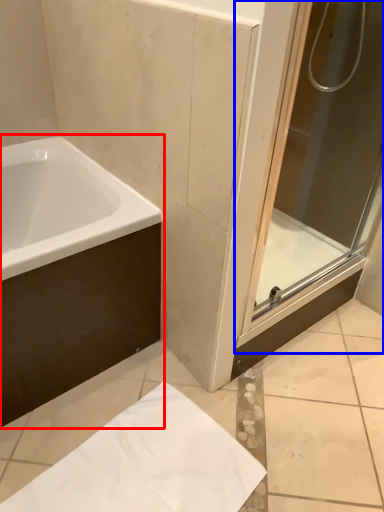
Question: Which object is closer to the camera taking this photo, bathtub (highlighted by a red box) or screen door (highlighted by a blue box)?

Choices:
 (A) bathtub
 (B) screen door

Answer: (B)